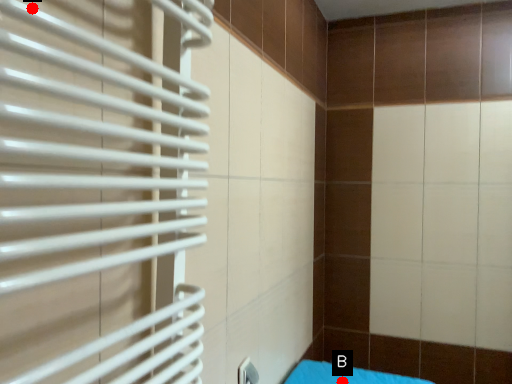
Question: Two points are circled on the image, labeled by A and B beside each circle. Among these points, which one is nearest to the camera?

Choices:
 (A) A is closer
 (B) B is closer

Answer: (A)